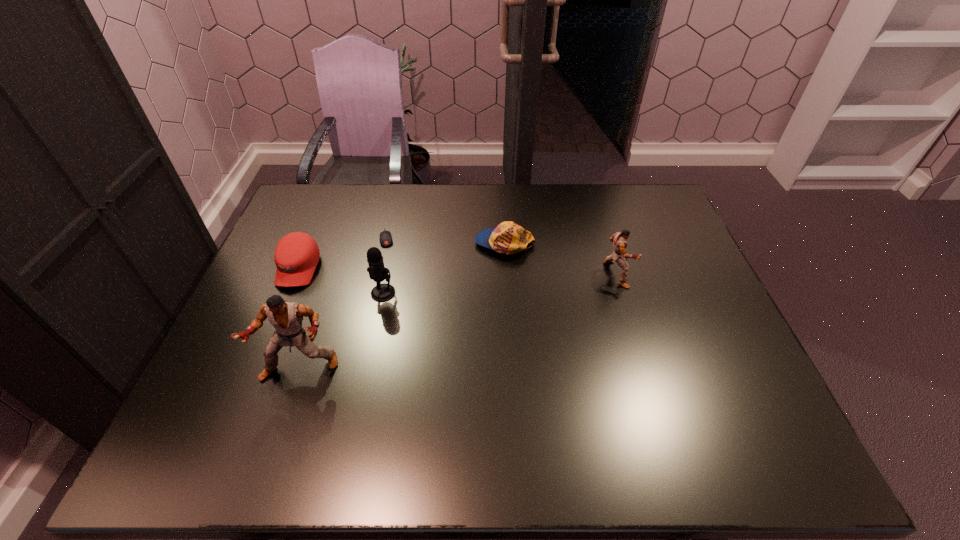
Find the location of a particular element. vacant space at the far edge of the desktop is located at coordinates (478, 207).

At what (x,y) coordinates should I click in order to perform the action: click on free location at the near edge of the desktop. Please return your answer as a coordinate pair (x, y). This screenshot has width=960, height=540. Looking at the image, I should click on (343, 395).

Identify the location of vacant region at the left edge of the desktop. The image size is (960, 540). (307, 293).

Where is `blank area at the right edge`? blank area at the right edge is located at coordinates (682, 328).

Find the location of a particular element. The image size is (960, 540). vacant space at the far left corner of the desktop is located at coordinates (296, 218).

In the image, there is a desktop. In order to click on vacant space at the near left corner in this screenshot , I will do pos(216,381).

The height and width of the screenshot is (540, 960). I want to click on free region at the far right corner of the desktop, so point(641,213).

This screenshot has height=540, width=960. I want to click on empty location between the rightmost object and the nearest object, so click(x=458, y=321).

Locate an element on the screen. Image resolution: width=960 pixels, height=540 pixels. vacant point located between the microphone and the shorter puncher is located at coordinates (500, 284).

Identify the location of unoccupied position between the left cap and the microphone. The height and width of the screenshot is (540, 960). (341, 281).